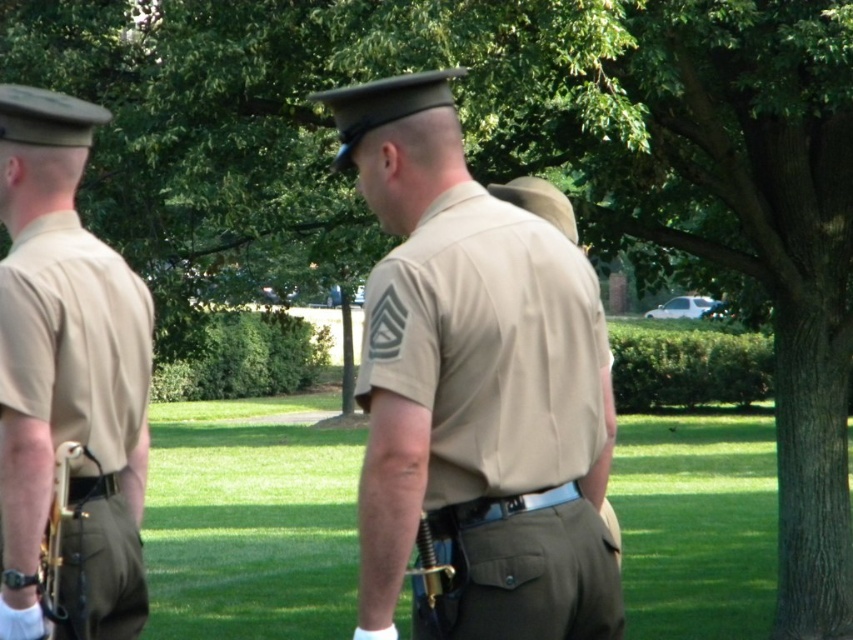
Question: Does tan fabric shirt at center come behind matte khaki uniform at left?

Choices:
 (A) no
 (B) yes

Answer: (A)

Question: Does tan fabric shirt at center have a greater width compared to matte khaki uniform at left?

Choices:
 (A) no
 (B) yes

Answer: (B)

Question: From the image, what is the correct spatial relationship of tan fabric shirt at center in relation to matte khaki uniform at left?

Choices:
 (A) below
 (B) above

Answer: (B)

Question: Which object is closer to the camera taking this photo?

Choices:
 (A) tan fabric shirt at center
 (B) matte khaki uniform at left

Answer: (A)